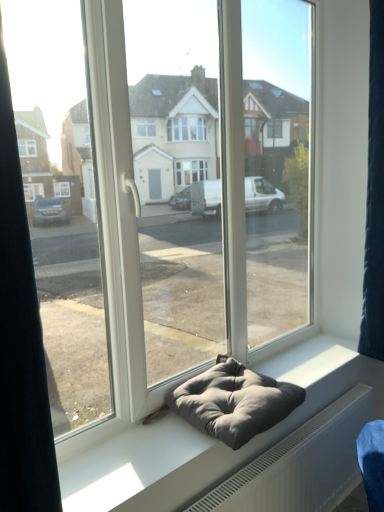
Question: From a real-world perspective, is transparent glass door at center positioned under gray fabric cushion at center based on gravity?

Choices:
 (A) no
 (B) yes

Answer: (A)

Question: Is gray fabric cushion at center inside transparent glass door at center?

Choices:
 (A) no
 (B) yes

Answer: (A)

Question: Is transparent glass door at center taller than gray fabric cushion at center?

Choices:
 (A) yes
 (B) no

Answer: (A)

Question: Does transparent glass door at center come behind gray fabric cushion at center?

Choices:
 (A) yes
 (B) no

Answer: (B)

Question: Considering the relative sizes of transparent glass door at center and gray fabric cushion at center in the image provided, is transparent glass door at center thinner than gray fabric cushion at center?

Choices:
 (A) no
 (B) yes

Answer: (B)

Question: Can you confirm if transparent glass door at center is shorter than gray fabric cushion at center?

Choices:
 (A) no
 (B) yes

Answer: (A)

Question: Is dark blue fabric at right next to transparent glass door at center?

Choices:
 (A) yes
 (B) no

Answer: (B)

Question: Considering the relative sizes of dark blue fabric at right and transparent glass door at center in the image provided, is dark blue fabric at right taller than transparent glass door at center?

Choices:
 (A) no
 (B) yes

Answer: (A)

Question: Can you confirm if dark blue fabric at right is shorter than transparent glass door at center?

Choices:
 (A) no
 (B) yes

Answer: (B)

Question: Is dark blue fabric at right aimed at transparent glass door at center?

Choices:
 (A) no
 (B) yes

Answer: (A)

Question: Does dark blue fabric at right have a lesser width compared to transparent glass door at center?

Choices:
 (A) yes
 (B) no

Answer: (B)

Question: Is the depth of dark blue fabric at right greater than that of transparent glass door at center?

Choices:
 (A) yes
 (B) no

Answer: (A)

Question: Is gray fabric bean bag at center not near gray fabric cushion at center?

Choices:
 (A) no
 (B) yes

Answer: (A)